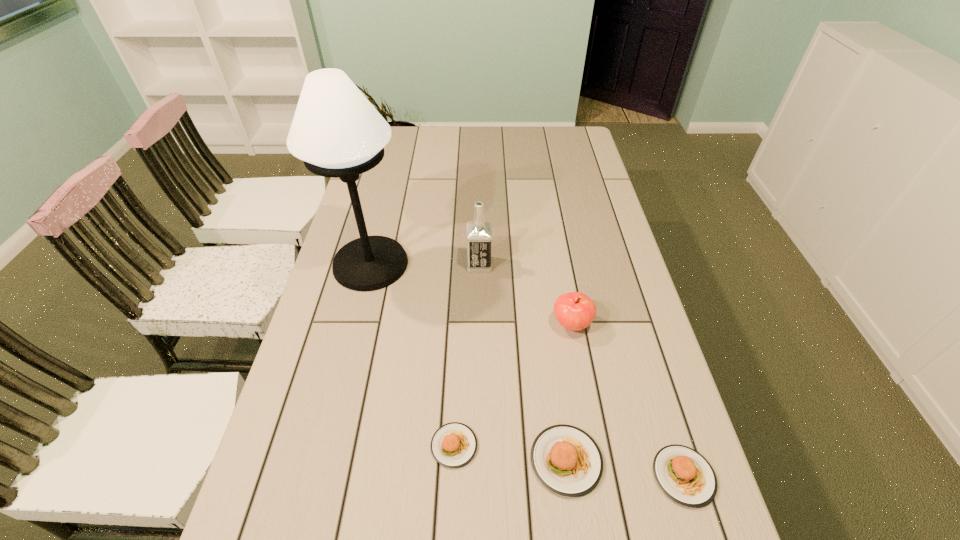
Image resolution: width=960 pixels, height=540 pixels. I want to click on the leftmost food, so click(x=453, y=445).

In order to click on the shortest object in this screenshot , I will do `click(453, 445)`.

At what (x,y) coordinates should I click in order to perform the action: click on the tallest food. Please return your answer as a coordinate pair (x, y). The image size is (960, 540). Looking at the image, I should click on (566, 460).

Locate an element on the screen. The image size is (960, 540). the fourth tallest object is located at coordinates (566, 460).

The width and height of the screenshot is (960, 540). I want to click on the rightmost object, so click(684, 475).

Where is `the second shortest food`? the second shortest food is located at coordinates (684, 475).

Find the location of a particular element. The height and width of the screenshot is (540, 960). the second tallest object is located at coordinates (478, 233).

Where is `the fourth shortest object`? The width and height of the screenshot is (960, 540). the fourth shortest object is located at coordinates (575, 311).

Locate an element on the screen. This screenshot has width=960, height=540. the fourth nearest object is located at coordinates (575, 311).

Find the location of a particular element. table lamp is located at coordinates (336, 131).